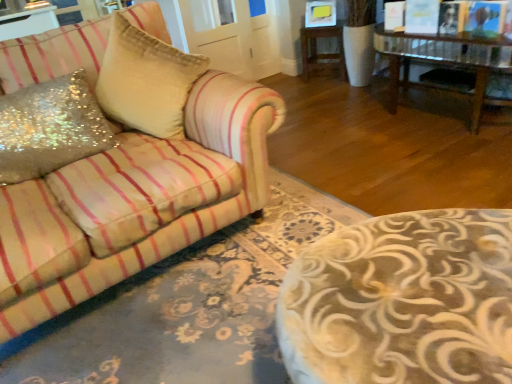
Question: From the image's perspective, is sequined fabric pillow at left, the 1th throw pillow viewed from the right, above or below glittery sequined pillow at left, which is the first throw pillow in left-to-right order?

Choices:
 (A) below
 (B) above

Answer: (B)

Question: Is sequined fabric pillow at left, the 1th throw pillow viewed from the right, taller or shorter than glittery sequined pillow at left, which is the second throw pillow from right to left?

Choices:
 (A) short
 (B) tall

Answer: (B)

Question: Estimate the real-world distances between objects in this image. Which object is farther from the glittery sequined pillow at left, which is the first throw pillow in left-to-right order?

Choices:
 (A) wooden side table at center
 (B) sequined fabric pillow at left, arranged as the second throw pillow when viewed from the left

Answer: (A)

Question: Which is farther from the wooden side table at center?

Choices:
 (A) glittery sequined pillow at left, which is the second throw pillow from right to left
 (B) sequined fabric pillow at left, arranged as the second throw pillow when viewed from the left

Answer: (A)